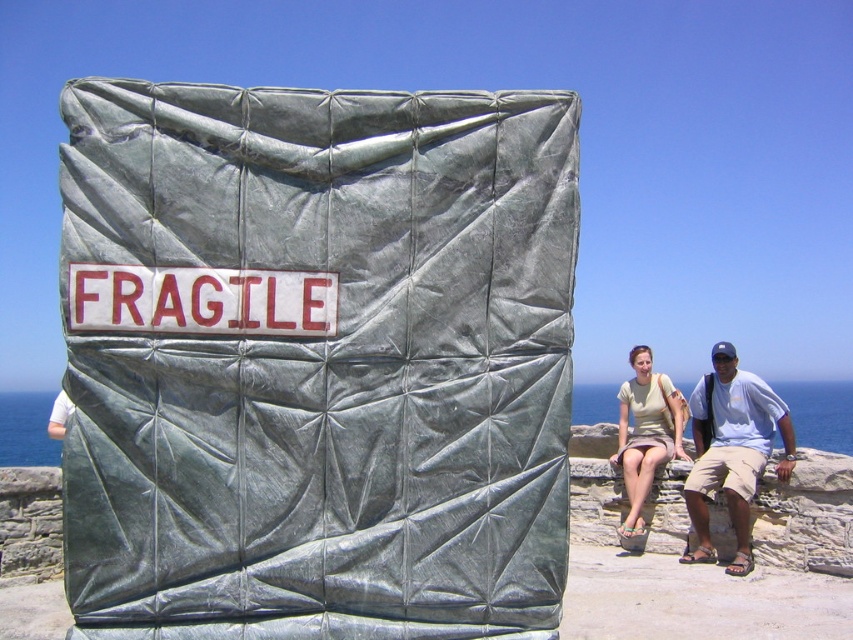
You are standing in front of the large rectangular object wrapped in greenish gray tarpaulin. There are two points marked on it at coordinates point (570, 204) and point (91, 323). If you were to touch both points, which one would feel closer to your hand?

Point (570, 204) is further to the viewer than point (91, 323), so when you touch both points, the point (570, 204) will feel closer to your hand.

You are a delivery person who needs to ensure that the white plastic sign at center and the light green cotton shirt at right are packed properly. Based on their sizes, which item requires a larger storage container?

The light green cotton shirt at right requires a larger storage container because the white plastic sign at center is smaller in size compared to it.

You are a delivery person who needs to lift the green tarp at center and the white plastic sign at center. Which object should you lift first if you want to access the item underneath the taller one?

The green tarp at center is taller than the white plastic sign at center, so you should lift the green tarp at center first to access the item underneath it.